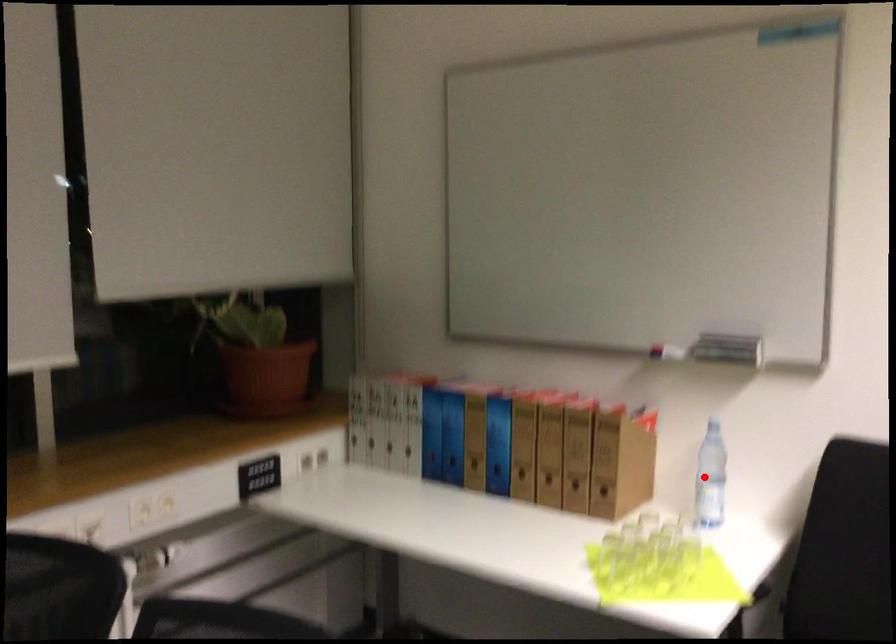
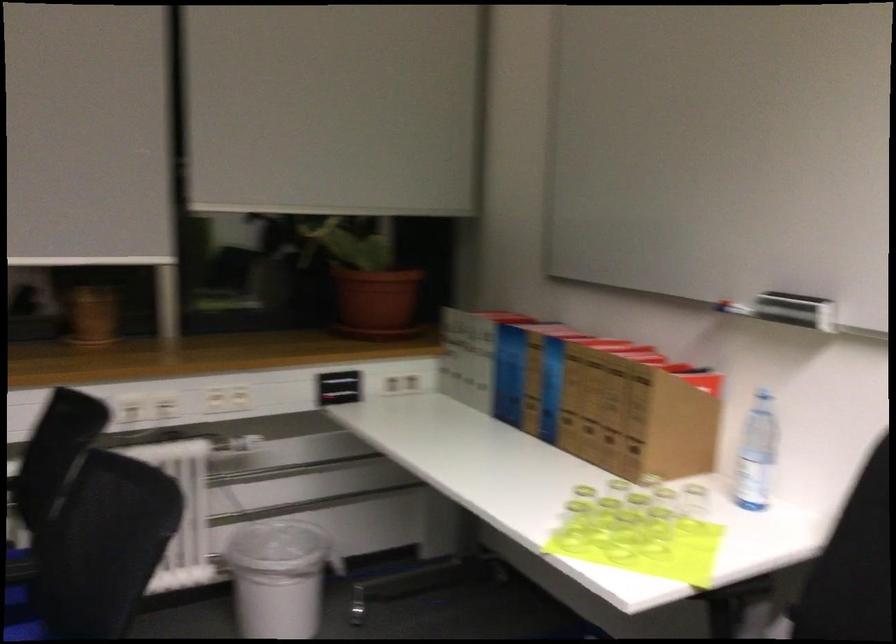
Question: I am providing you with two images of the same scene from different viewpoints. A red point is shown in image1. For the corresponding object point in image2, is it positioned nearer or farther from the camera?

Choices:
 (A) Nearer
 (B) Farther

Answer: (A)